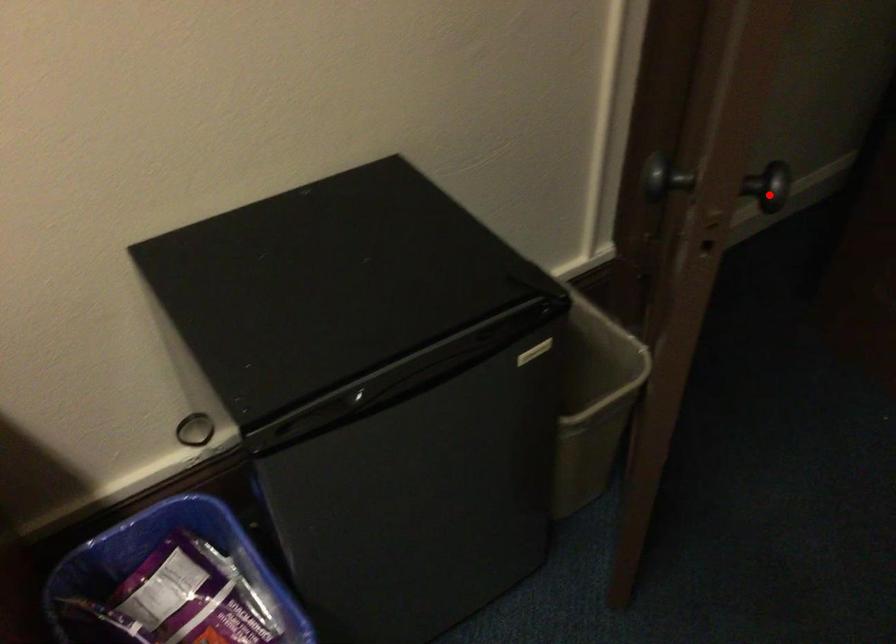
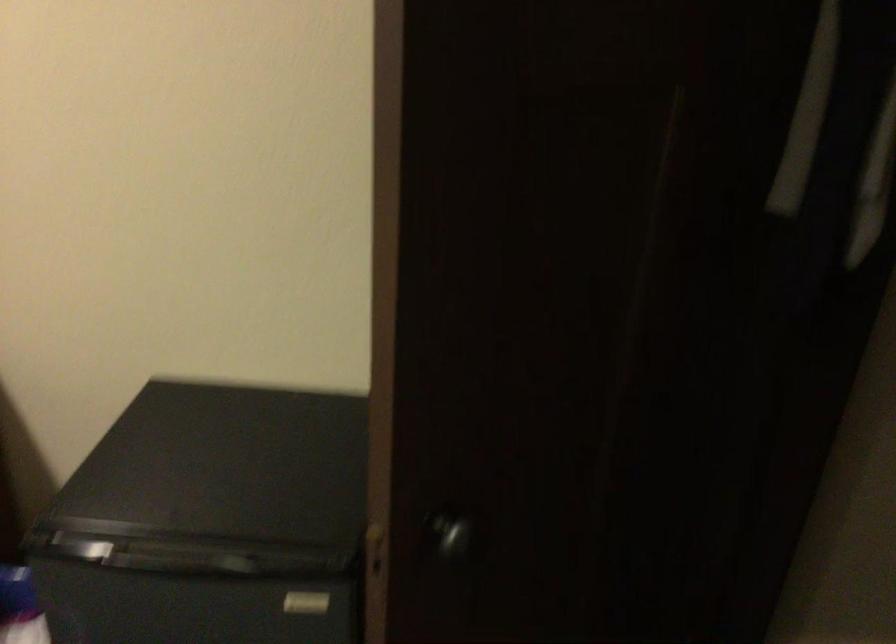
Find the pixel in the second image that matches the highlighted location in the first image.

(451, 535)